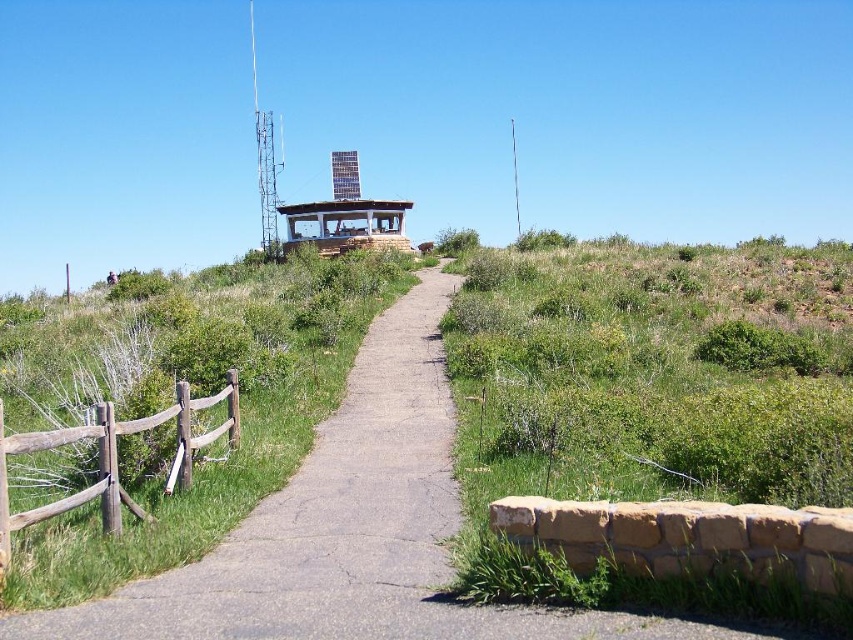
Question: Among these objects, which one is nearest to the camera?

Choices:
 (A) wooden gazebo at center
 (B) brown wooden fence at left

Answer: (B)

Question: Does brown wooden fence at left have a lesser width compared to wooden gazebo at center?

Choices:
 (A) no
 (B) yes

Answer: (B)

Question: Is brown wooden fence at left wider than wooden gazebo at center?

Choices:
 (A) no
 (B) yes

Answer: (A)

Question: Does brown wooden fence at left come in front of wooden gazebo at center?

Choices:
 (A) yes
 (B) no

Answer: (A)

Question: Which of the following is the farthest from the observer?

Choices:
 (A) wooden gazebo at center
 (B) brown wooden fence at left

Answer: (A)